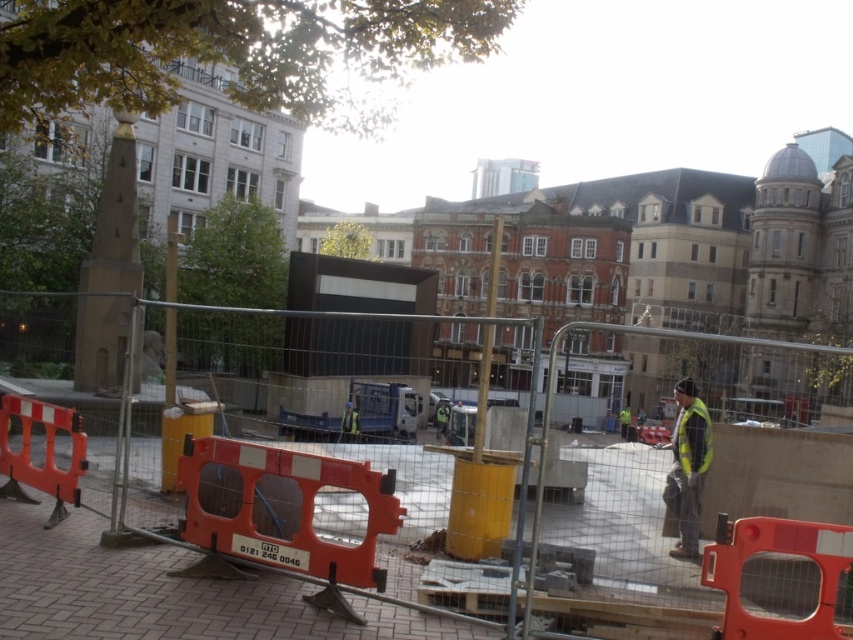
Question: Does reflective yellow vest at center appear over yellow reflective safety vest at right?

Choices:
 (A) yes
 (B) no

Answer: (B)

Question: Among these objects, which one is nearest to the camera?

Choices:
 (A) orange plastic barrier at center
 (B) yellow reflective safety vest at right

Answer: (A)

Question: Is orange plastic barrier at center positioned behind reflective yellow vest at center?

Choices:
 (A) no
 (B) yes

Answer: (A)

Question: Which is nearer to the reflective yellow vest at center?

Choices:
 (A) yellow reflective safety vest at right
 (B) orange plastic barrier at center

Answer: (A)

Question: Is orange plastic barrier at center positioned behind reflective yellow vest at center?

Choices:
 (A) no
 (B) yes

Answer: (A)

Question: Which object is positioned farthest from the reflective yellow vest at center?

Choices:
 (A) orange plastic barrier at center
 (B) yellow reflective safety vest at right

Answer: (A)